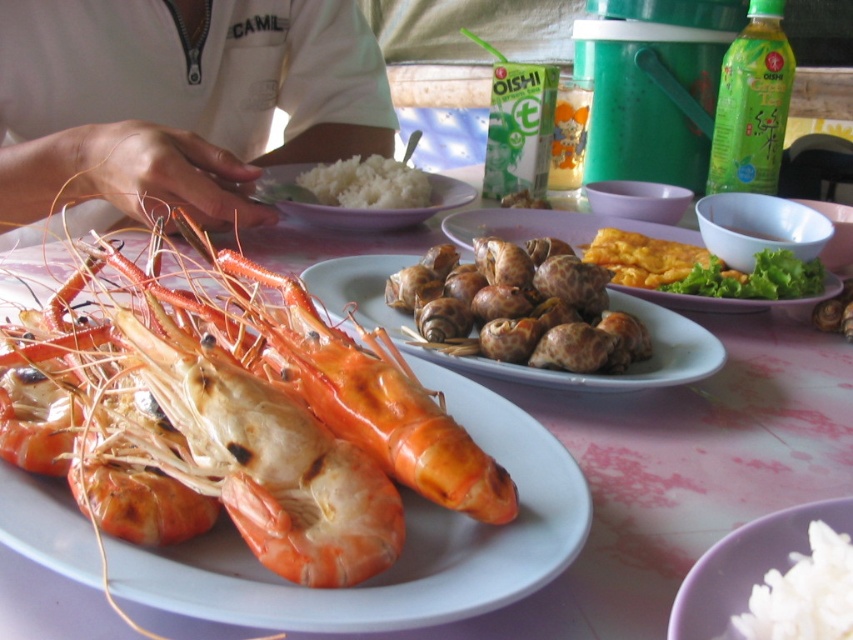
Which is above, brown textured snails at center or smooth brown snail at center?

smooth brown snail at center is higher up.

Is point (544, 353) farther from viewer compared to point (519, 195)?

No, it is not.

At what (x,y) coordinates should I click in order to perform the action: click on brown textured snails at center. Please return your answer as a coordinate pair (x, y). The width and height of the screenshot is (853, 640). Looking at the image, I should click on (519, 307).

Who is positioned more to the left, brown textured snails at center or yellow fried egg at center?

From the viewer's perspective, brown textured snails at center appears more on the left side.

Is point (595, 330) closer to camera compared to point (660, 280)?

That is True.

Identify the location of brown textured snails at center. (519, 307).

Does point (511, 291) come in front of point (294, 209)?

That is True.

Is brown textured snails at center to the right of white matte plate at center from the viewer's perspective?

Correct, you'll find brown textured snails at center to the right of white matte plate at center.

Locate an element on the screen. brown textured snails at center is located at coordinates (519, 307).

I want to click on brown textured snails at center, so click(519, 307).